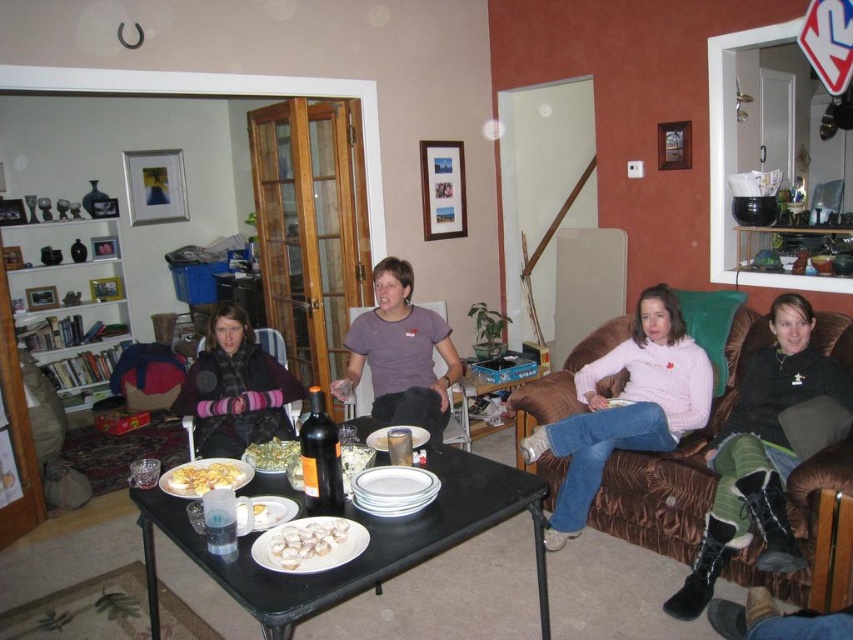
You are a guest at this gathering and want to grab a salad from the green leafy salad at center without leaving your current seat in the matte black armchair at lower left. Can you reach the salad if you can extend your arm 80 centimeters?

The matte black armchair at lower left is 79.63 centimeters from the green leafy salad at center, so yes, you can reach the salad with an arm extension of 80 centimeters since it is just slightly shorter than the distance.

You are standing at the entrance of the living room and want to sit in the matte black armchair at lower left. Which direction should you walk to reach it?

Since the matte black armchair at lower left is located at point 0.614 on the x coordinate and 0.277 on the y coordinate, you should walk towards the lower left direction to reach it.

You are standing in the living room and want to reach both the point at coordinates (190, 474) and the point at coordinates (292, 483). Which point will you reach first as you move towards them?

You will reach the point at coordinates (190, 474) first because it is closer to you than the point at coordinates (292, 483).